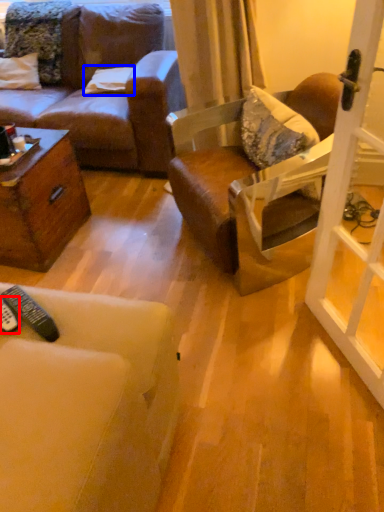
Question: Which object is further to the camera taking this photo, remote control (highlighted by a red box) or pillow (highlighted by a blue box)?

Choices:
 (A) remote control
 (B) pillow

Answer: (B)